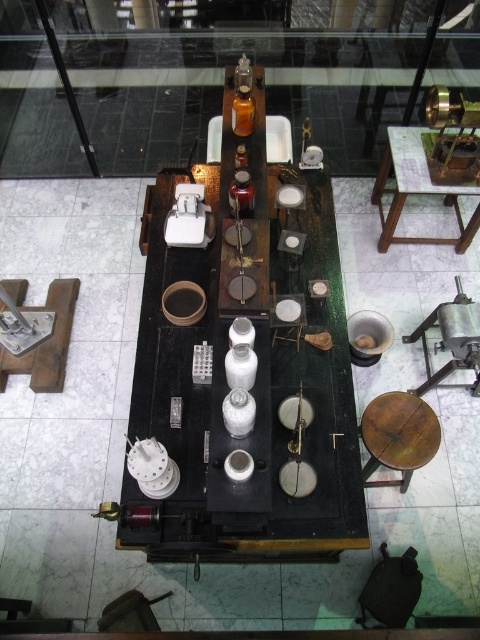
Does wooden table at center appear on the left side of wooden stool at lower right?

Indeed, wooden table at center is positioned on the left side of wooden stool at lower right.

Is wooden table at center further to the viewer compared to wooden stool at lower right?

No.

Describe the element at coordinates (252, 387) in the screenshot. I see `wooden table at center` at that location.

You are a GUI agent. You are given a task and a screenshot of the screen. Output one action in this format:
    pyautogui.click(x=<x>, y=<y>)
    Task: Click on the wooden table at center
    
    Given the screenshot: What is the action you would take?
    pyautogui.click(x=252, y=387)

Does wooden table at upper right have a smaller size compared to wooden stool at lower right?

No, wooden table at upper right is not smaller than wooden stool at lower right.

Is point (468, 225) in front of point (418, 401)?

No, (468, 225) is behind (418, 401).

Is point (393, 193) farther from camera compared to point (397, 483)?

Yes, it is.

Image resolution: width=480 pixels, height=640 pixels. I want to click on wooden table at upper right, so click(417, 189).

Is point (301, 554) farther from viewer compared to point (435, 192)?

No, (301, 554) is closer to viewer.

Is point (274, 376) positioned behind point (428, 189)?

That is False.

Where is `wooden table at center`? Image resolution: width=480 pixels, height=640 pixels. wooden table at center is located at coordinates pyautogui.click(x=252, y=387).